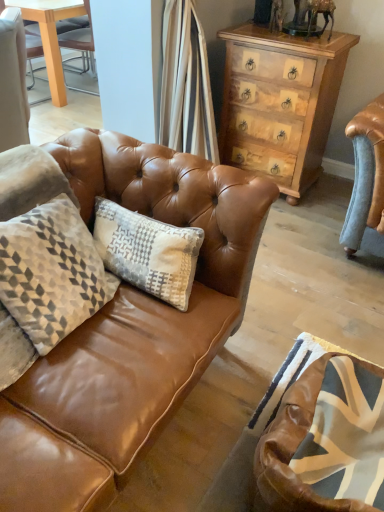
You are a GUI agent. You are given a task and a screenshot of the screen. Output one action in this format:
    pyautogui.click(x=<x>, y=<y>)
    Task: Click on the light brown wood chest of drawers at upper right
    This screenshot has height=512, width=384.
    Given the screenshot: What is the action you would take?
    pyautogui.click(x=280, y=102)

Locate an element on the screen. light brown wood chest of drawers at upper right is located at coordinates (280, 102).

Based on the photo, from a real-world perspective, which is physically above, brown leather swivel chair at lower right or light brown wood chest of drawers at upper right?

In real-world perspective, light brown wood chest of drawers at upper right is above.

Considering the sizes of objects brown leather swivel chair at lower right and light brown wood chest of drawers at upper right in the image provided, who is smaller, brown leather swivel chair at lower right or light brown wood chest of drawers at upper right?

With smaller size is brown leather swivel chair at lower right.

Does brown leather swivel chair at lower right come behind light brown wood chest of drawers at upper right?

No, brown leather swivel chair at lower right is in front of light brown wood chest of drawers at upper right.

Is light brown wood chest of drawers at upper right at the back of brown leather swivel chair at lower right?

No, brown leather swivel chair at lower right is not facing away from light brown wood chest of drawers at upper right.

Between matte brown leather couch at center and brown leather swivel chair at lower right, which one has smaller size?

brown leather swivel chair at lower right.

How different are the orientations of matte brown leather couch at center and brown leather swivel chair at lower right in degrees?

The facing directions of matte brown leather couch at center and brown leather swivel chair at lower right are 2.29 degrees apart.

Could you tell me if matte brown leather couch at center is turned towards brown leather swivel chair at lower right?

No, matte brown leather couch at center is not turned towards brown leather swivel chair at lower right.

From a real-world perspective, which is physically above, matte brown leather couch at center or brown leather swivel chair at lower right?

In real-world perspective, brown leather swivel chair at lower right is above.

Find the location of `the chest of drawers above the brown leather swivel chair at lower right (from the image's perspective)`. the chest of drawers above the brown leather swivel chair at lower right (from the image's perspective) is located at coordinates (280, 102).

Is light brown wood chest of drawers at upper right facing away from brown leather swivel chair at lower right?

No.

Considering their positions, is light brown wood chest of drawers at upper right located in front of or behind brown leather swivel chair at lower right?

In the image, light brown wood chest of drawers at upper right appears behind brown leather swivel chair at lower right.

Is light brown wood chest of drawers at upper right positioned beyond the bounds of brown leather swivel chair at lower right?

Yes, light brown wood chest of drawers at upper right is not within brown leather swivel chair at lower right.

Can you confirm if brown leather swivel chair at lower right is positioned to the right of matte brown leather couch at center?

No, brown leather swivel chair at lower right is not to the right of matte brown leather couch at center.

Is brown leather swivel chair at lower right positioned in front of matte brown leather couch at center?

Yes, it is.

From the image's perspective, between brown leather swivel chair at lower right and matte brown leather couch at center, which one is located above?

matte brown leather couch at center appears higher in the image.

Is matte brown leather couch at center at the back of brown leather swivel chair at lower right?

No, brown leather swivel chair at lower right is not facing away from matte brown leather couch at center.

Which object is positioned more to the left, light brown wood chest of drawers at upper right or matte brown leather couch at center?

From the viewer's perspective, matte brown leather couch at center appears more on the left side.

From a real-world perspective, relative to matte brown leather couch at center, is light brown wood chest of drawers at upper right vertically above or below?

light brown wood chest of drawers at upper right is above matte brown leather couch at center.

Which is behind, point (288, 143) or point (189, 183)?

The point (288, 143) is behind.

From the image's perspective, is light brown wood chest of drawers at upper right located above or below matte brown leather couch at center?

Clearly, from the image's perspective, light brown wood chest of drawers at upper right is above matte brown leather couch at center.

From the image's perspective, is matte brown leather couch at center on light brown wood chest of drawers at upper right?

Incorrect, from the image's perspective, matte brown leather couch at center is lower than light brown wood chest of drawers at upper right.

Considering the positions of points (28, 401) and (274, 81), is point (28, 401) farther from camera compared to point (274, 81)?

No, it is not.

From a real-world perspective, which is physically above, matte brown leather couch at center or light brown wood chest of drawers at upper right?

light brown wood chest of drawers at upper right is physically above.

Does matte brown leather couch at center have a lesser width compared to light brown wood chest of drawers at upper right?

In fact, matte brown leather couch at center might be wider than light brown wood chest of drawers at upper right.

Identify the location of swivel chair on the left of the light brown wood chest of drawers at upper right. (325, 441).

At what (x,y) coordinates should I click in order to perform the action: click on swivel chair below the matte brown leather couch at center (from the image's perspective). Please return your answer as a coordinate pair (x, y). The width and height of the screenshot is (384, 512). Looking at the image, I should click on (325, 441).

Based on their spatial positions, is matte brown leather couch at center or brown leather swivel chair at lower right further from light brown wood chest of drawers at upper right?

The object further to light brown wood chest of drawers at upper right is brown leather swivel chair at lower right.

Estimate the real-world distances between objects in this image. Which object is further from brown leather swivel chair at lower right, light brown wood chest of drawers at upper right or matte brown leather couch at center?

light brown wood chest of drawers at upper right is positioned further to the anchor brown leather swivel chair at lower right.

From the image, which object appears to be nearer to matte brown leather couch at center, brown leather swivel chair at lower right or light brown wood chest of drawers at upper right?

brown leather swivel chair at lower right is closer to matte brown leather couch at center.

From the image, which object appears to be farther from light brown wood chest of drawers at upper right, brown leather swivel chair at lower right or matte brown leather couch at center?

brown leather swivel chair at lower right.

Which object lies further to the anchor point matte brown leather couch at center, light brown wood chest of drawers at upper right or brown leather swivel chair at lower right?

light brown wood chest of drawers at upper right.

Which object lies nearer to the anchor point brown leather swivel chair at lower right, matte brown leather couch at center or light brown wood chest of drawers at upper right?

matte brown leather couch at center is positioned closer to the anchor brown leather swivel chair at lower right.

This screenshot has width=384, height=512. I want to click on studio couch between light brown wood chest of drawers at upper right and brown leather swivel chair at lower right in the up-down direction, so click(x=129, y=327).